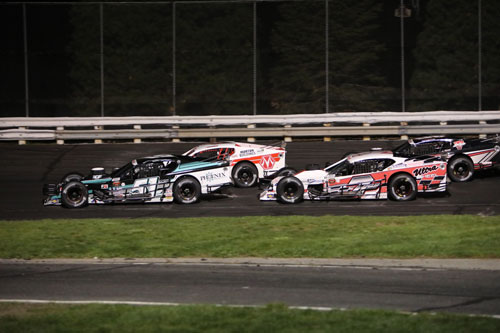
In order to click on vertical support poles for track lighting in this screenshot , I will do `click(25, 55)`, `click(101, 54)`, `click(175, 56)`, `click(254, 54)`, `click(327, 51)`, `click(403, 50)`, `click(481, 52)`.